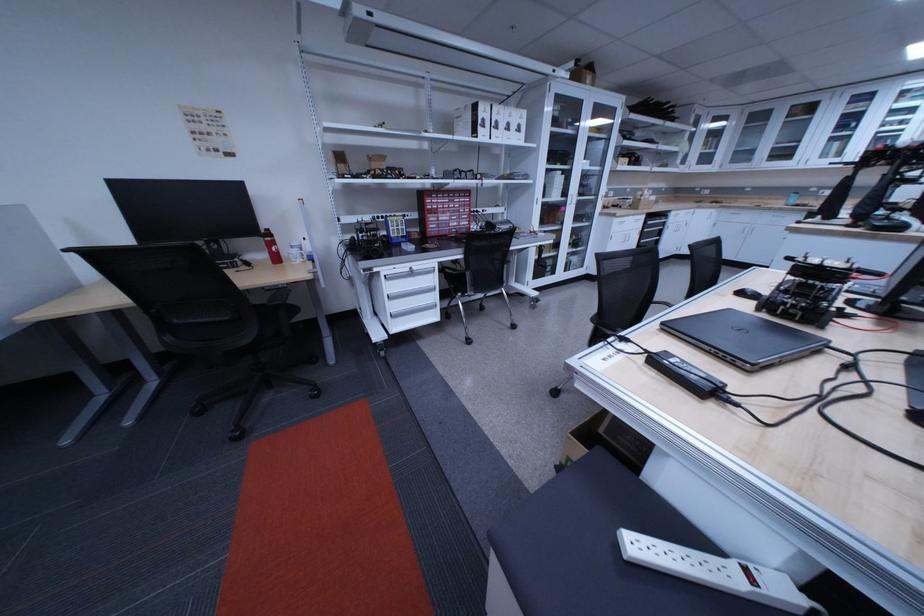
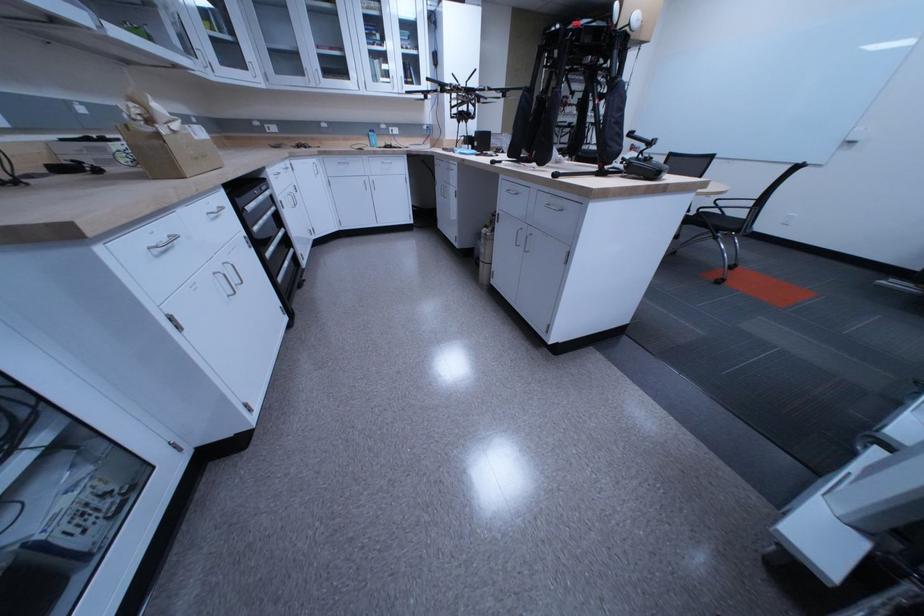
Find the pixel in the second image that matches the point at 792,201 in the first image.

(373, 140)